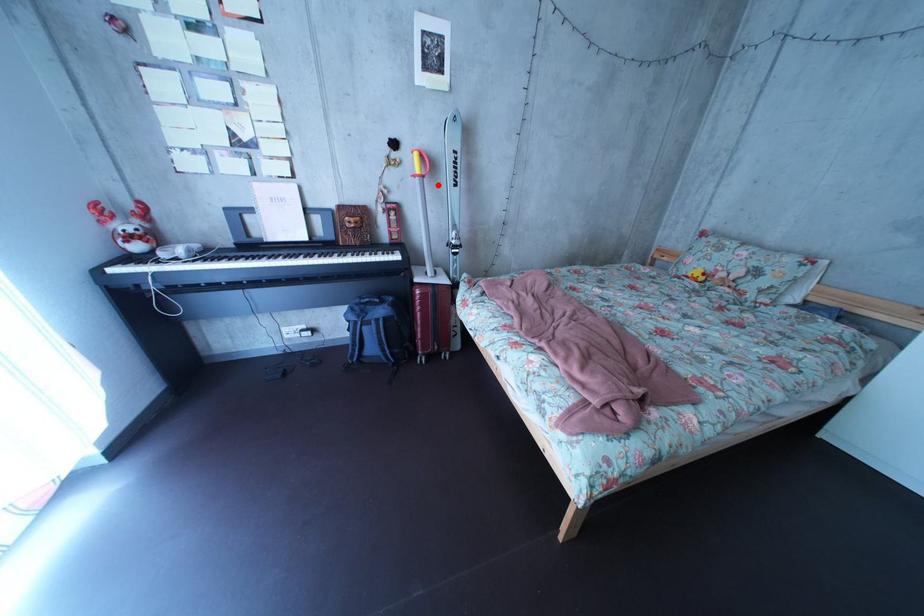
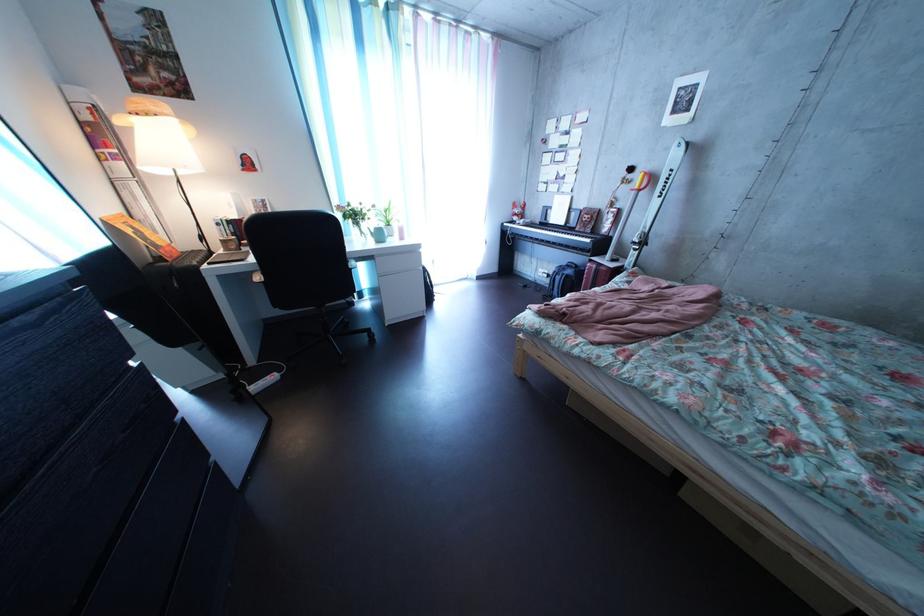
Question: I am providing you with two images of the same scene from different viewpoints. A red point is shown in image1. For the corresponding object point in image2, is it positioned nearer or farther from the camera?

Choices:
 (A) Nearer
 (B) Farther

Answer: (B)